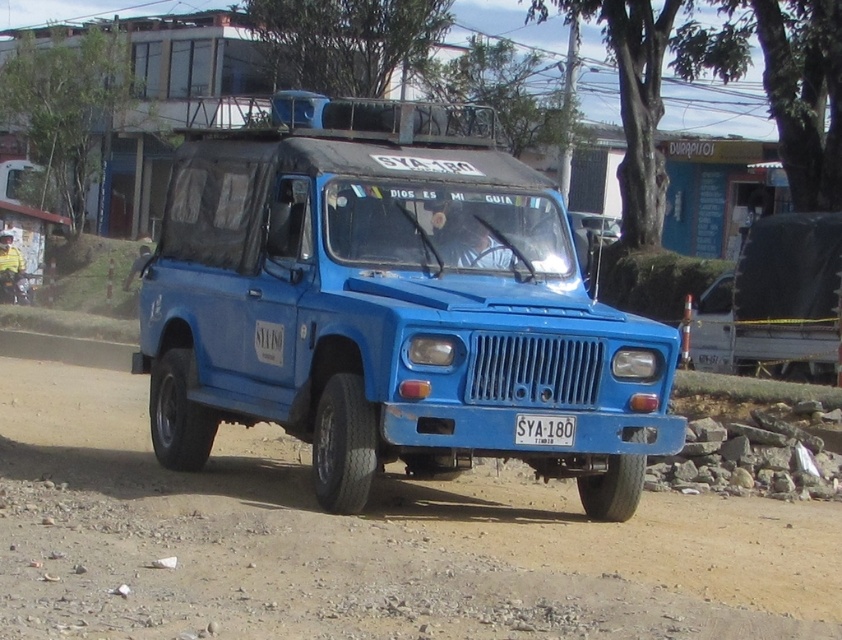
Question: Which point is closer to the camera taking this photo?

Choices:
 (A) (12, 625)
 (B) (537, 426)

Answer: (A)

Question: Is blue matte jeep at center further to camera compared to dirt field at center?

Choices:
 (A) no
 (B) yes

Answer: (B)

Question: Which is farther from the white plastic license plate at center?

Choices:
 (A) blue matte jeep at center
 (B) dirt field at center

Answer: (A)

Question: Among these points, which one is nearest to the camera?

Choices:
 (A) (531, 444)
 (B) (465, 632)

Answer: (B)

Question: Does blue matte jeep at center appear under dirt field at center?

Choices:
 (A) yes
 (B) no

Answer: (B)

Question: Where is dirt field at center located in relation to white plastic license plate at center in the image?

Choices:
 (A) below
 (B) above

Answer: (A)